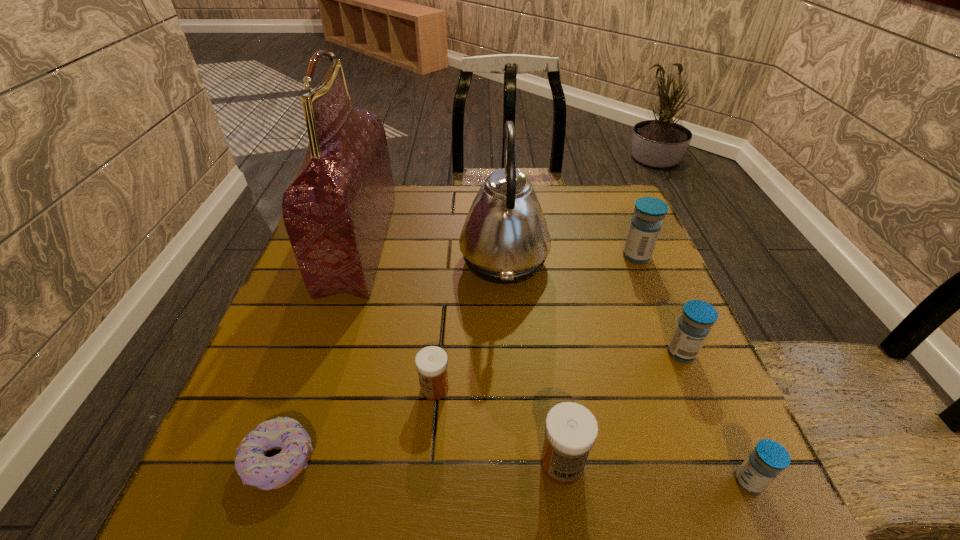
Image resolution: width=960 pixels, height=540 pixels. In order to click on vacant space positioned on the right of the farther white medicine in this screenshot , I will do `click(601, 389)`.

You are a GUI agent. You are given a task and a screenshot of the screen. Output one action in this format:
    pyautogui.click(x=<x>, y=<y>)
    Task: Click on the blank space located on the back of the nearest blue medicine
    This screenshot has height=540, width=960.
    Given the screenshot: What is the action you would take?
    pyautogui.click(x=679, y=323)

Find the location of a particular element. The image size is (960, 540). vacant space located on the right of the brown doughnut is located at coordinates (561, 460).

This screenshot has width=960, height=540. I want to click on handbag present at the far edge, so click(336, 210).

Identify the location of kettle at the far edge. This screenshot has width=960, height=540. (505, 239).

What are the coordinates of `doughnut at the near edge` in the screenshot? It's located at coord(255,469).

Identify the location of handbag that is at the left edge. (336, 210).

Where is `doughnut present at the left edge`? The height and width of the screenshot is (540, 960). doughnut present at the left edge is located at coordinates (255, 469).

What are the coordinates of `object that is positioned at the far left corner` in the screenshot? It's located at (336, 210).

At what (x,y) coordinates should I click in order to perform the action: click on object present at the near left corner. Please return your answer as a coordinate pair (x, y). The image size is (960, 540). Looking at the image, I should click on tap(255, 469).